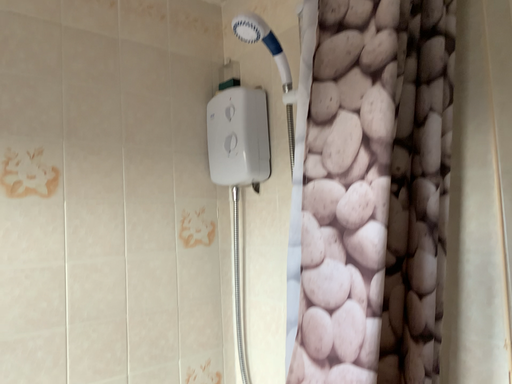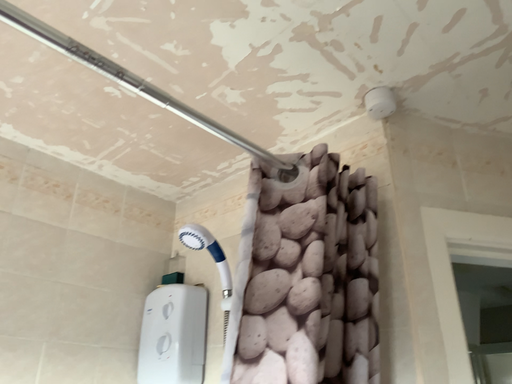
Question: Which way did the camera rotate in the video?

Choices:
 (A) rotated right
 (B) rotated left

Answer: (A)